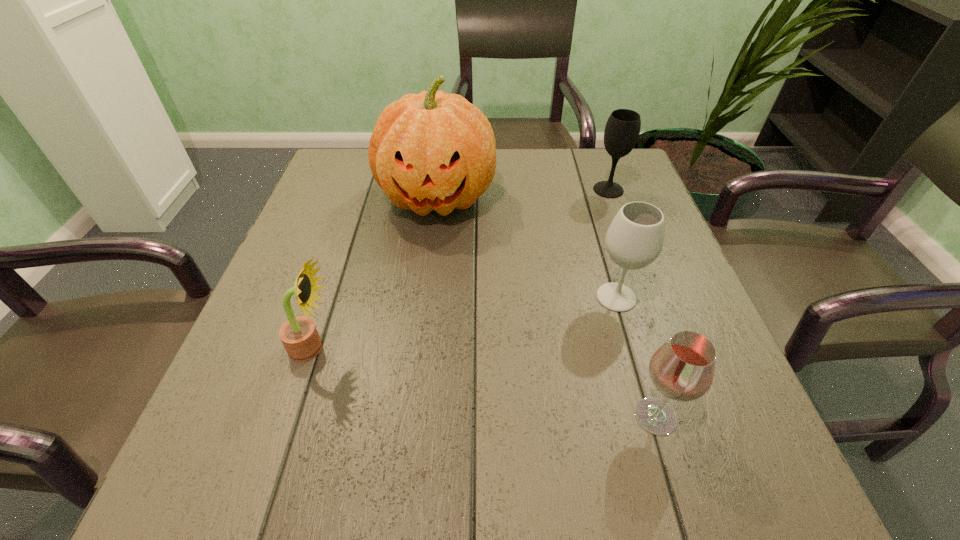
Where is `free space located on the face of the leftmost object`? free space located on the face of the leftmost object is located at coordinates (527, 348).

Identify the location of vacant space positioned on the left of the nearest wineglass. This screenshot has width=960, height=540. coord(558,416).

Where is `pumpkin present at the far edge`? This screenshot has height=540, width=960. pumpkin present at the far edge is located at coordinates (430, 151).

Find the location of a particular element. wineglass situated at the far edge is located at coordinates (622, 129).

What are the coordinates of `object that is positioned at the left edge` in the screenshot? It's located at (299, 336).

Find the location of a particular element. The image size is (960, 540). object at the far right corner is located at coordinates (622, 129).

This screenshot has height=540, width=960. Find the location of `free space at the far edge of the desktop`. free space at the far edge of the desktop is located at coordinates (543, 156).

At what (x,y) coordinates should I click in order to perform the action: click on vacant region at the near edge of the desktop. Please return your answer as a coordinate pair (x, y). Looking at the image, I should click on (502, 459).

I want to click on vacant point at the left edge, so click(x=242, y=388).

Find the location of a particular element. The width and height of the screenshot is (960, 540). free space at the right edge is located at coordinates [x=600, y=225].